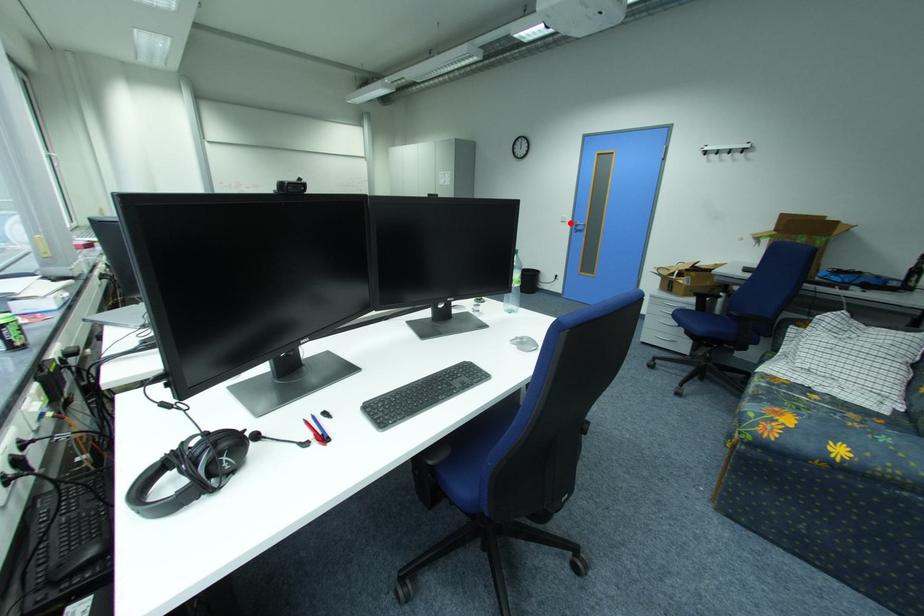
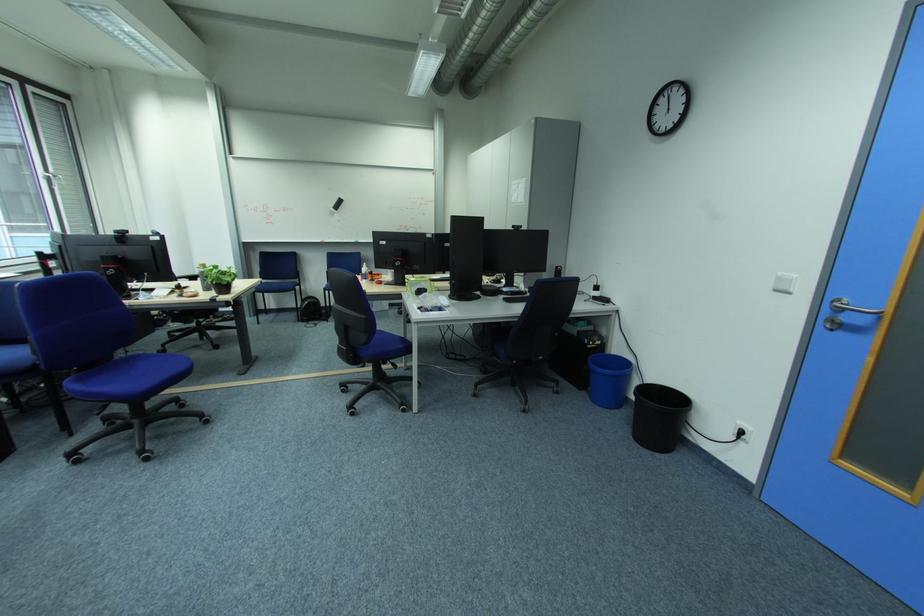
Where in the second image is the point corresponding to the highlighted location from the first image?

(785, 292)